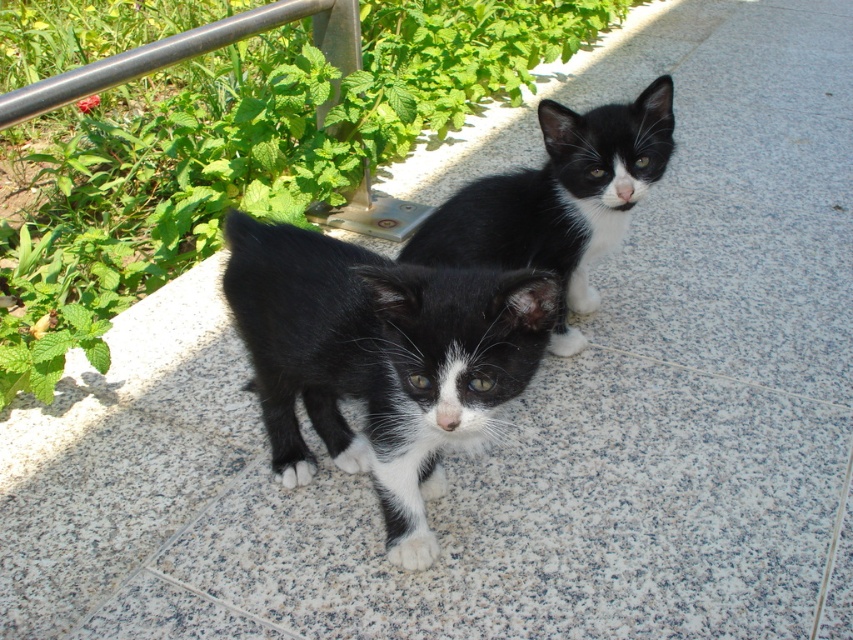
Based on the coordinates provided, where exactly is the black fur kitten at center located in the image?

The black fur kitten at center is located at coordinates point (x=378, y=356).

You are a photographer trying to capture a closeup of the kittens. You have a focus point at point (491,308) and another at point (627,138). Which focus point should you use to get the kitten that is closer to you in focus?

Point (491,308) is closer to the viewer than point (627,138), so you should use the focus point at point (491,308) to capture the closer kitten in focus.